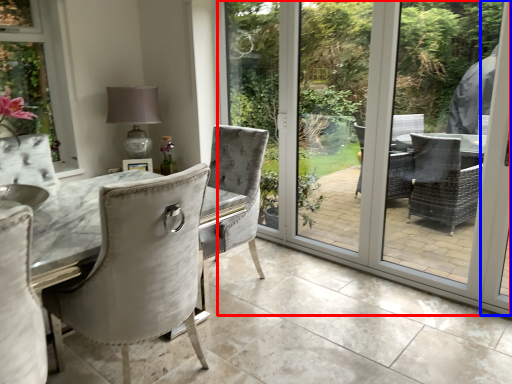
Question: Which object is further to the camera taking this photo, screen door (highlighted by a red box) or screen door (highlighted by a blue box)?

Choices:
 (A) screen door
 (B) screen door

Answer: (B)